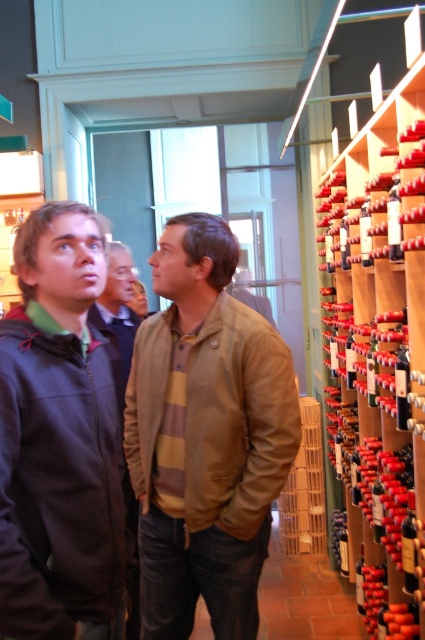
Question: Which of the following is the closest to the observer?

Choices:
 (A) translucent glass bottle at right
 (B) matte glass wine bottle at center right

Answer: (A)

Question: Is dark brown leather jacket at center below matte glass wine bottle at center right?

Choices:
 (A) yes
 (B) no

Answer: (A)

Question: Which point is closer to the camera taking this photo?

Choices:
 (A) (394, 202)
 (B) (138, 620)
 (C) (413, 492)

Answer: (A)

Question: Observing the image, what is the correct spatial positioning of brown leather jacket at center in reference to wooden at right?

Choices:
 (A) left
 (B) right

Answer: (A)

Question: Based on their relative distances, which object is nearer to the dark brown leather jacket at center?

Choices:
 (A) wooden at right
 (B) brown leather jacket at center
 (C) dark gray jacket at left
 (D) translucent glass bottle at right

Answer: (C)

Question: Does wooden at right appear on the right side of dark gray jacket at left?

Choices:
 (A) yes
 (B) no

Answer: (A)